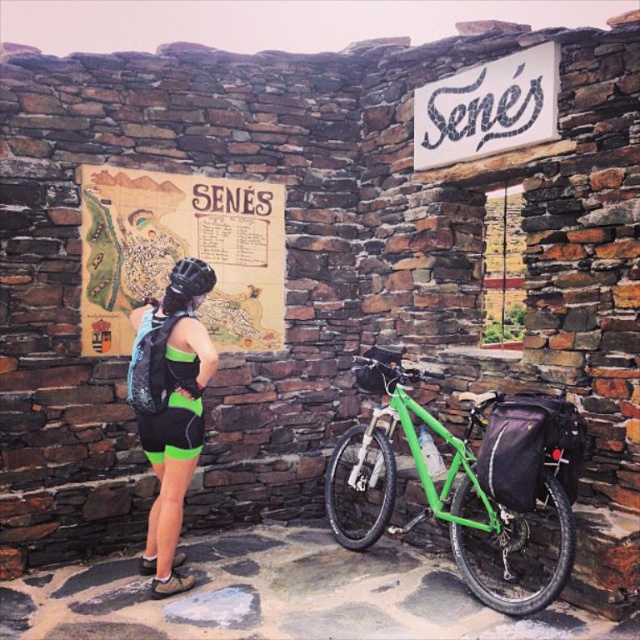
Who is positioned more to the right, green matte bicycle at center or black matte bicycle helmet at center?

Positioned to the right is green matte bicycle at center.

Does green matte bicycle at center have a lesser height compared to black matte bicycle helmet at center?

In fact, green matte bicycle at center may be taller than black matte bicycle helmet at center.

Between point (500, 436) and point (182, 288), which one is positioned in front?

Point (500, 436)

At what (x,y) coordinates should I click in order to perform the action: click on green matte bicycle at center. Please return your answer as a coordinate pair (x, y). Looking at the image, I should click on (467, 483).

Can you confirm if matte black helmet at upper left is smaller than black matte bicycle helmet at center?

Actually, matte black helmet at upper left might be larger than black matte bicycle helmet at center.

Does matte black helmet at upper left come behind black matte bicycle helmet at center?

No, it is not.

Is point (168, 474) positioned behind point (214, 273)?

No, it is in front of (214, 273).

At what (x,y) coordinates should I click in order to perform the action: click on matte black helmet at upper left. Please return your answer as a coordinate pair (x, y). Looking at the image, I should click on (170, 406).

Does green matte bicycle at center appear over matte black helmet at upper left?

No.

Does green matte bicycle at center have a larger size compared to matte black helmet at upper left?

Indeed, green matte bicycle at center has a larger size compared to matte black helmet at upper left.

Between point (566, 404) and point (156, 410), which one is positioned behind?

Positioned behind is point (156, 410).

Find the location of a particular element. green matte bicycle at center is located at coordinates (467, 483).